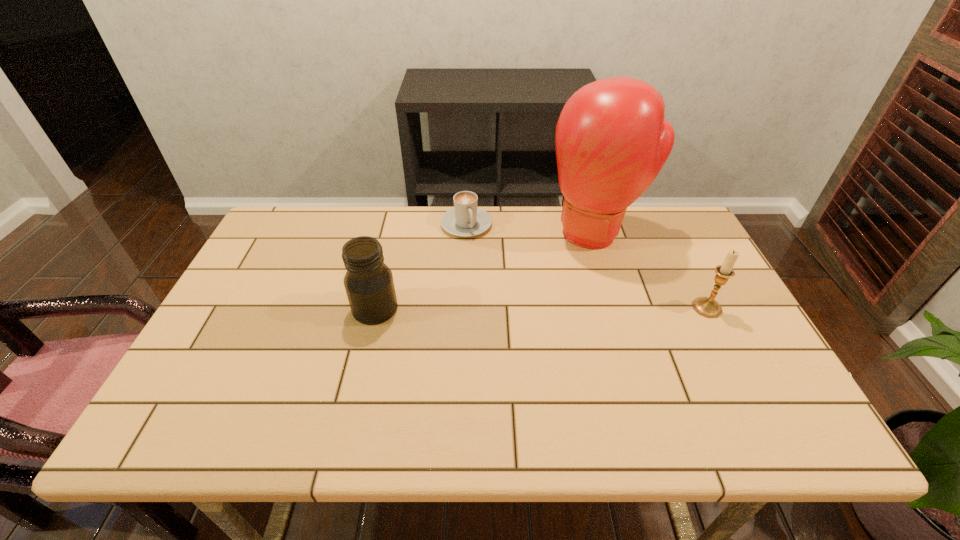
Identify the location of vacant region at the near edge of the desktop. Image resolution: width=960 pixels, height=540 pixels. (656, 382).

I want to click on free space at the left edge, so click(x=268, y=265).

At what (x,y) coordinates should I click in order to perform the action: click on vacant space at the right edge of the desktop. Please return your answer as a coordinate pair (x, y). Looking at the image, I should click on (708, 295).

At what (x,y) coordinates should I click in order to perform the action: click on vacant region at the far left corner. Please return your answer as a coordinate pair (x, y). Looking at the image, I should click on (301, 235).

The image size is (960, 540). In the image, there is a desktop. What are the coordinates of `vacant space at the far right corner` in the screenshot? It's located at (665, 232).

Image resolution: width=960 pixels, height=540 pixels. Find the location of `free spot between the boxing glove and the rightmost object`. free spot between the boxing glove and the rightmost object is located at coordinates (652, 270).

You are a GUI agent. You are given a task and a screenshot of the screen. Output one action in this format:
    pyautogui.click(x=<x>, y=<y>)
    Task: Click on the free space between the leftmost object and the shortest object
    The image size is (960, 540).
    Given the screenshot: What is the action you would take?
    pyautogui.click(x=420, y=267)

Find the location of `vacant area that lies between the second object from left to right and the jar`. vacant area that lies between the second object from left to right and the jar is located at coordinates (420, 267).

Find the location of a particular element. This screenshot has width=960, height=540. vacant region between the rightmost object and the jar is located at coordinates (541, 308).

I want to click on free space between the boxing glove and the candle holder, so click(652, 270).